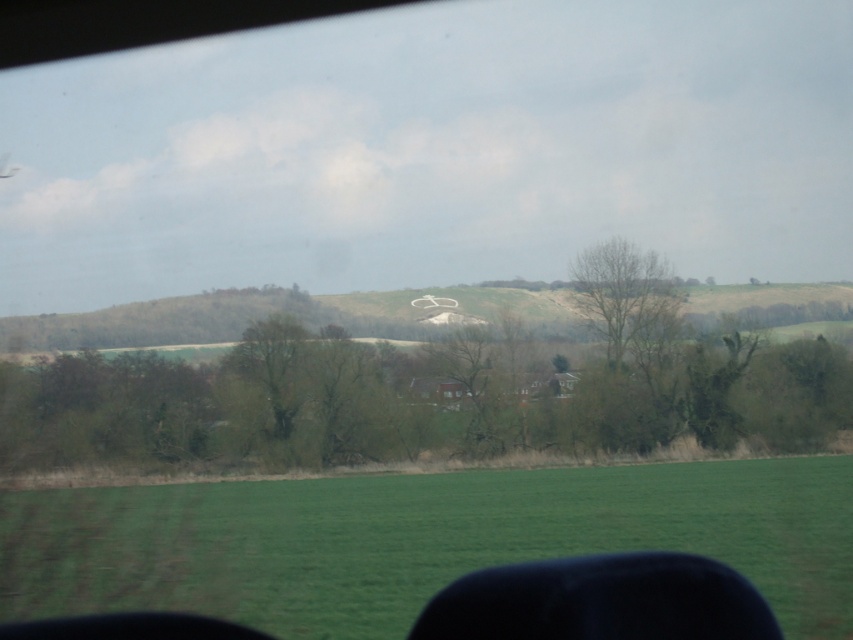
Who is taller, green leafy tree at center or bare wood tree at center?

green leafy tree at center is taller.

Is green leafy tree at center behind bare wood tree at center?

No, green leafy tree at center is closer to the viewer.

The height and width of the screenshot is (640, 853). Find the location of `green leafy tree at center`. green leafy tree at center is located at coordinates (432, 372).

Locate an element on the screen. green leafy tree at center is located at coordinates (432, 372).

Who is taller, green grass at lower center or bare wood tree at center?

With more height is bare wood tree at center.

Is point (514, 497) more distant than point (619, 339)?

No, it is in front of (619, 339).

Is point (596, 532) positioned before point (637, 266)?

Yes, point (596, 532) is closer to viewer.

Locate an element on the screen. green grass at lower center is located at coordinates (421, 540).

Is green leafy tree at center bigger than green grass at lower center?

Correct, green leafy tree at center is larger in size than green grass at lower center.

Does point (415, 332) lie in front of point (241, 516)?

That is False.

This screenshot has height=640, width=853. In order to click on green leafy tree at center in this screenshot , I will do `click(432, 372)`.